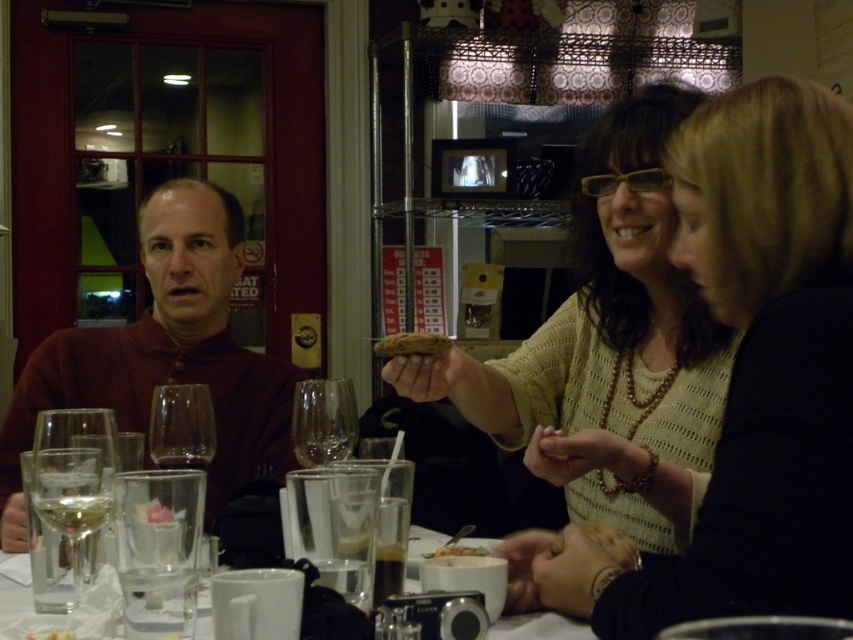
Is knitted beige sweater at center positioned in front of white glossy mug at lower center?

No, it is behind white glossy mug at lower center.

Which is more to the left, knitted beige sweater at center or white glossy mug at lower center?

white glossy mug at lower center

Who is more distant from viewer, (670, 304) or (558, 620)?

The point (670, 304) is more distant.

You are a GUI agent. You are given a task and a screenshot of the screen. Output one action in this format:
    pyautogui.click(x=<x>, y=<y>)
    Task: Click on the knitted beige sweater at center
    
    Given the screenshot: What is the action you would take?
    click(x=606, y=314)

Between white glossy mug at lower center and clear glass wine glass at center, which one appears on the left side from the viewer's perspective?

clear glass wine glass at center is more to the left.

Is white glossy mug at lower center wider than clear glass wine glass at center?

Result: Yes, white glossy mug at lower center is wider than clear glass wine glass at center.

What do you see at coordinates (538, 627) in the screenshot?
I see `white glossy mug at lower center` at bounding box center [538, 627].

At what (x,y) coordinates should I click in order to perform the action: click on white glossy mug at lower center. Please return your answer as a coordinate pair (x, y). This screenshot has height=640, width=853. Looking at the image, I should click on (538, 627).

Between knitted beige sweater at center and white creamy soup at center, which one appears on the right side from the viewer's perspective?

From the viewer's perspective, knitted beige sweater at center appears more on the right side.

What do you see at coordinates (606, 314) in the screenshot? The width and height of the screenshot is (853, 640). I see `knitted beige sweater at center` at bounding box center [606, 314].

Where is `knitted beige sweater at center`? This screenshot has height=640, width=853. knitted beige sweater at center is located at coordinates point(606,314).